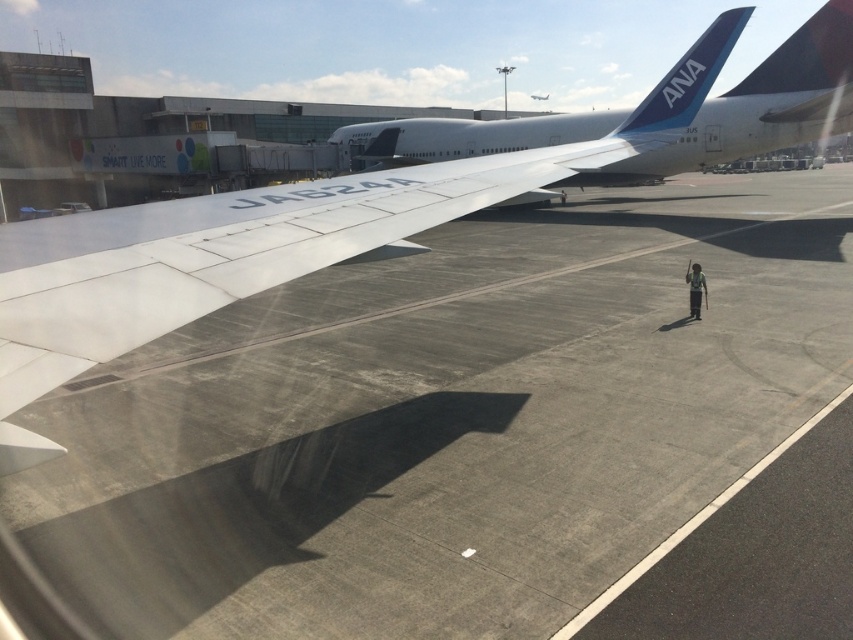
Question: Does white matte wing at center appear under green fabric person at center?

Choices:
 (A) no
 (B) yes

Answer: (B)

Question: Which point appears farthest from the camera in this image?

Choices:
 (A) (285, 250)
 (B) (693, 300)
 (C) (561, 196)
 (D) (326, 429)

Answer: (C)

Question: Is gray concrete runway at center below green fabric pants at center?

Choices:
 (A) no
 (B) yes

Answer: (A)

Question: Does gray concrete runway at center have a smaller size compared to green fabric pants at center?

Choices:
 (A) yes
 (B) no

Answer: (B)

Question: Which point is farther from the camera taking this photo?

Choices:
 (A) (560, 196)
 (B) (67, 518)

Answer: (A)

Question: Among these points, which one is nearest to the camera?

Choices:
 (A) (45, 244)
 (B) (704, 292)

Answer: (A)